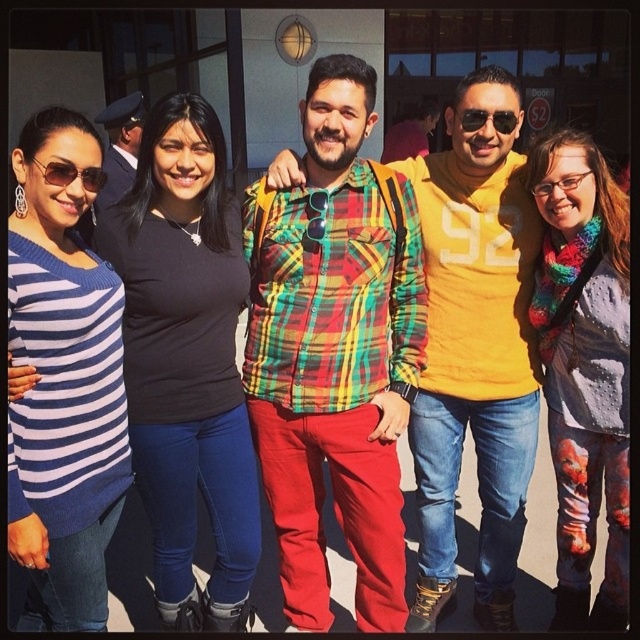
Which of these two, multicolored plaid shirt at center or sunglasses at center, stands shorter?

sunglasses at center is shorter.

Where is `multicolored plaid shirt at center`? Image resolution: width=640 pixels, height=640 pixels. multicolored plaid shirt at center is located at coordinates (336, 352).

Who is more distant from viewer, [560,252] or [486,115]?

The point [560,252] is behind.

Based on the photo, which of these two, knitted scarf at center or sunglasses at center, stands shorter?

Standing shorter between the two is sunglasses at center.

This screenshot has height=640, width=640. What do you see at coordinates (584, 369) in the screenshot? I see `knitted scarf at center` at bounding box center [584, 369].

Where is `knitted scarf at center`? The width and height of the screenshot is (640, 640). knitted scarf at center is located at coordinates (584, 369).

Consider the image. Measure the distance between point [76,484] and camera.

Point [76,484] and camera are 2.05 meters apart from each other.

Which is in front, point (84, 358) or point (477, 120)?

Positioned in front is point (84, 358).

Does point (35, 522) lie behind point (499, 112)?

No.

What are the coordinates of `blue and white striped sweater at left` in the screenshot? It's located at (61, 385).